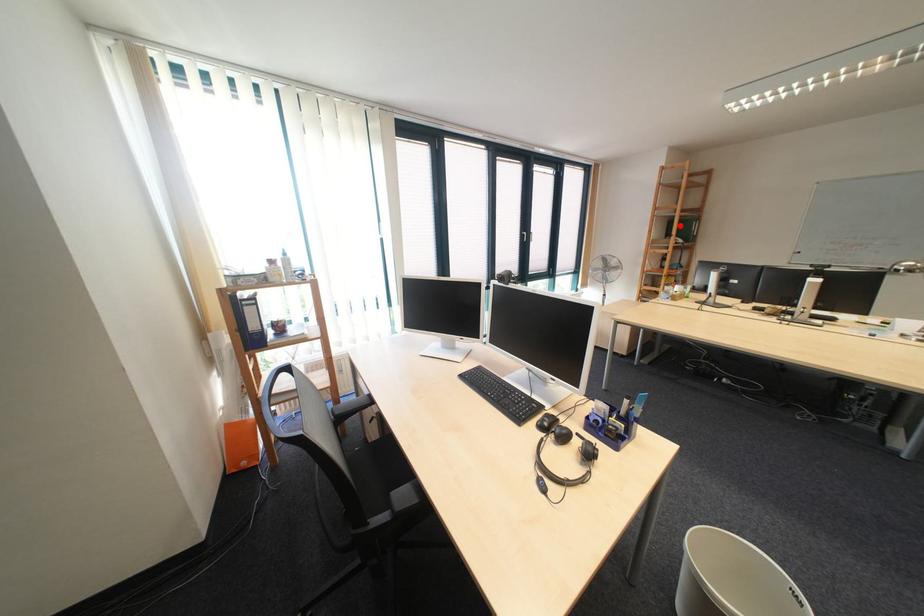
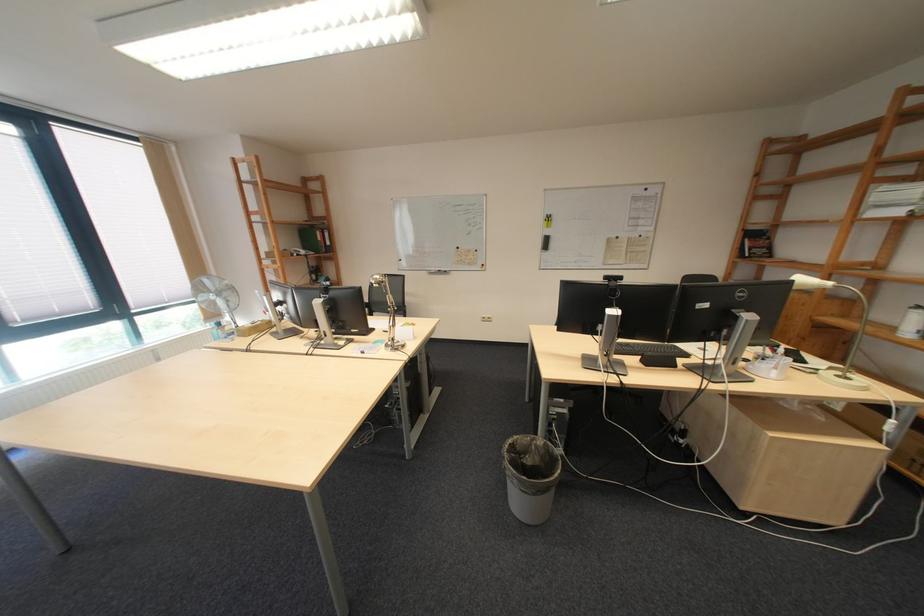
Where in the second image is the point corresponding to the highlighted location from the first image?

(310, 233)